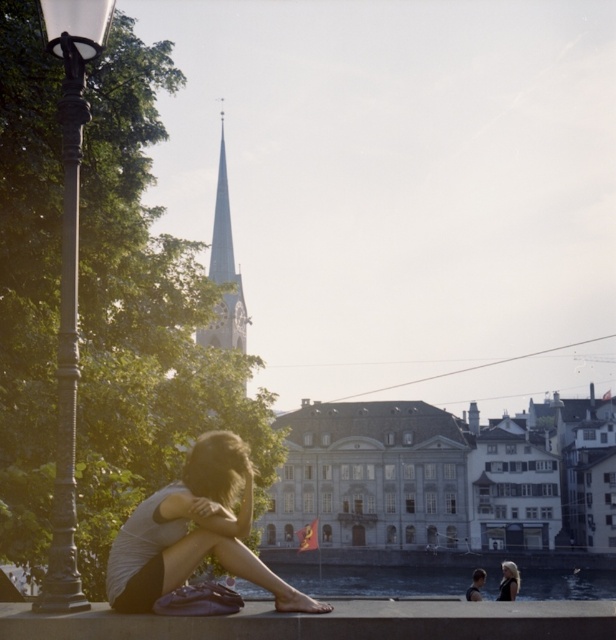
You are standing at the riverside and see the clear water at lower center and the smooth white spire at center. Which object is positioned to the right of the other?

The clear water at lower center is positioned to the right of the smooth white spire at center.

You are standing on the riverside path and see the clear water at lower center and the smooth white spire at center. Which object is closer to you?

The clear water at lower center is closer to you since it is further to the viewer than the smooth white spire at center.